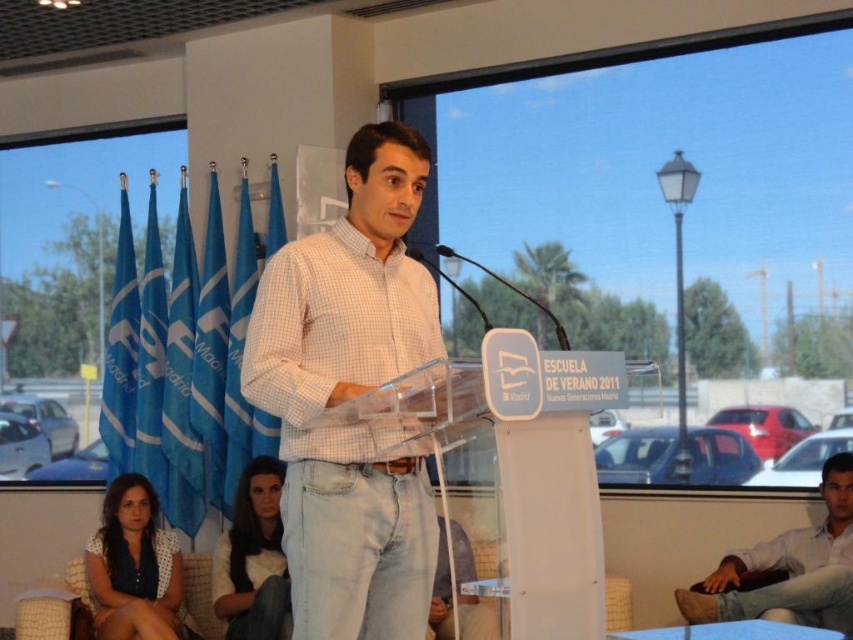
You are an event planner organizing a photoshoot for the speaker. You need to ensure that the white checkered shirt at center and the light brown leather pants at lower right are visible in the frame. Given their sizes, which clothing item should you focus on framing first to ensure it is fully captured?

The white checkered shirt at center is larger in size than the light brown leather pants at lower right, so you should focus on framing the white checkered shirt at center first to ensure it is fully captured in the photo.

You are an event organizer who needs to ensure all speakers are visible to the audience. Considering the white checkered shirt at center and the light brown leather pants at lower right, which one might block the view of the other if they stand near each other?

The white checkered shirt at center is much taller than the light brown leather pants at lower right, so if they stand near each other, the white checkered shirt at center could block the view of the light brown leather pants at lower right.